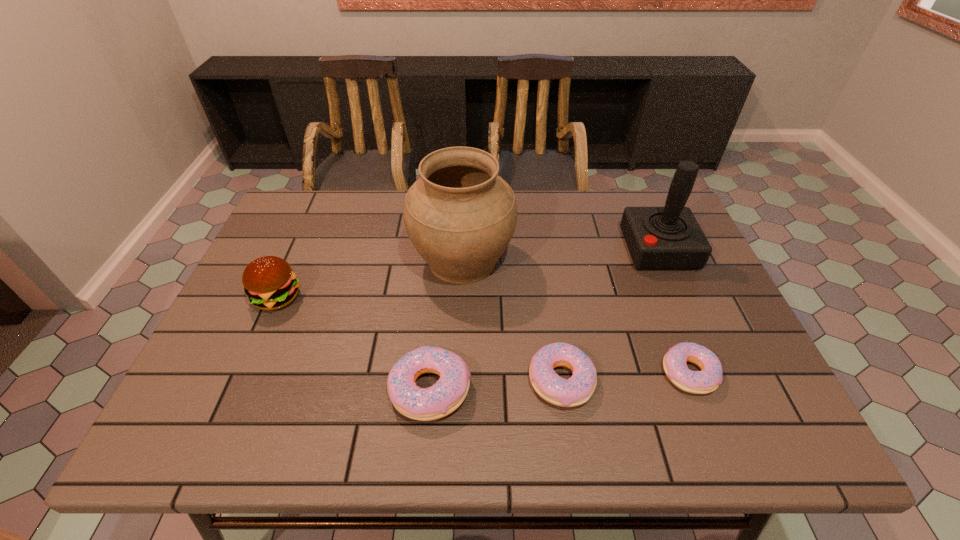
Where is `the leftmost doughnut`? This screenshot has width=960, height=540. the leftmost doughnut is located at coordinates (441, 399).

Find the location of a particular element. the fifth tallest object is located at coordinates (577, 390).

At what (x,y) coordinates should I click in order to perform the action: click on the second shortest doughnut. Please return your answer as a coordinate pair (x, y). The height and width of the screenshot is (540, 960). Looking at the image, I should click on (577, 390).

Image resolution: width=960 pixels, height=540 pixels. I want to click on the shortest object, so click(707, 380).

Find the location of `the shortest doughnut`. the shortest doughnut is located at coordinates (707, 380).

At what (x,y) coordinates should I click in order to perform the action: click on joystick. Please return your answer as a coordinate pair (x, y). Image resolution: width=960 pixels, height=540 pixels. Looking at the image, I should click on (658, 238).

Identify the location of urn. The image size is (960, 540). (460, 216).

The image size is (960, 540). What are the coordinates of `the leftmost object` in the screenshot? It's located at (269, 282).

I want to click on hamburger, so click(x=269, y=282).

Identify the location of free space located 0.280m on the left of the leftmost doughnut. The height and width of the screenshot is (540, 960). (259, 389).